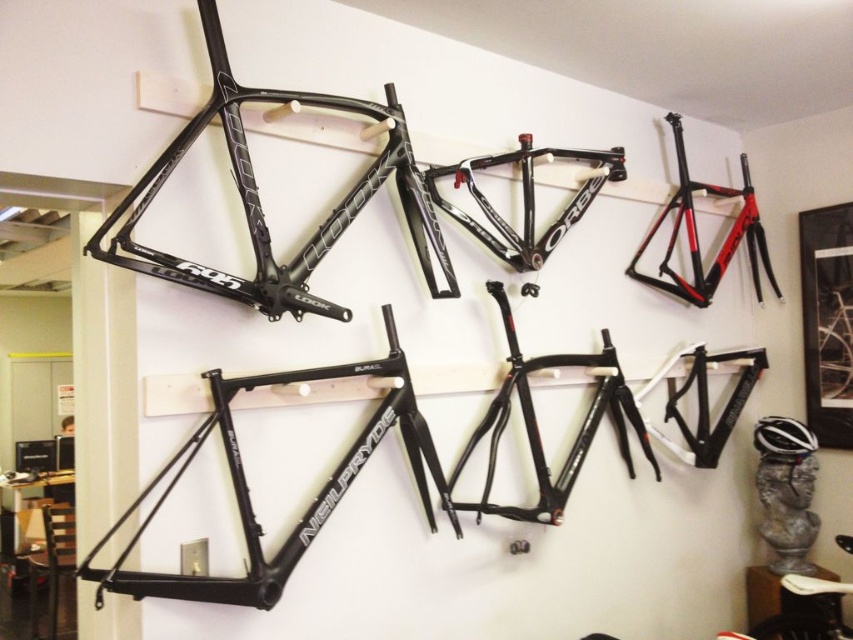
Between black matte bicycle frame at center and matte black frame at upper center, which one is positioned lower?

Positioned lower is black matte bicycle frame at center.

Looking at this image, who is more forward, (125, 515) or (329, 225)?

Positioned in front is point (125, 515).

Locate an element on the screen. black matte bicycle frame at center is located at coordinates (369, 456).